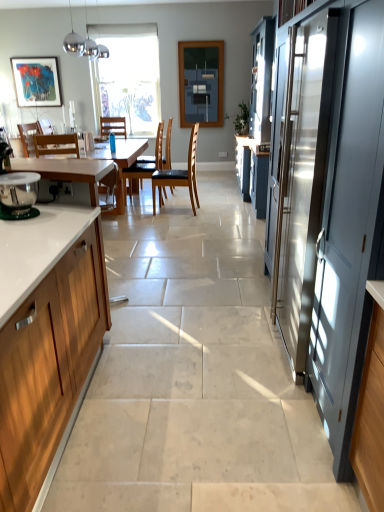
What do you see at coordinates (349, 227) in the screenshot? I see `matte gray screen door at right` at bounding box center [349, 227].

I want to click on matte gray screen door at right, so click(349, 227).

Identify the location of transparent glass window at center. (127, 76).

What do you see at coordinates (127, 76) in the screenshot? I see `transparent glass window at center` at bounding box center [127, 76].

Describe the element at coordinates (144, 165) in the screenshot. I see `wooden chair at center, the 3th chair when ordered from left to right` at that location.

Find the location of `matte glass window screen at center`. matte glass window screen at center is located at coordinates (201, 83).

You are a GUI agent. You are given a task and a screenshot of the screen. Output one action in this format:
    pyautogui.click(x=<x>, y=<y>)
    Task: Click on the black leather chair at center, placed as the first chair when sorted from right to left
    
    Given the screenshot: What is the action you would take?
    pyautogui.click(x=179, y=175)

Consider the image. Which is more to the left, white wood cabinet at left or wooden chair at center, positioned as the 2th chair in left-to-right order?

Positioned to the left is wooden chair at center, positioned as the 2th chair in left-to-right order.

You are a GUI agent. You are given a task and a screenshot of the screen. Output one action in this format:
    pyautogui.click(x=<x>, y=<y>)
    Task: Click on the 3rd chair directly beneath the white wood cabinet at left (from a real-world perspective)
    The image size is (384, 512).
    Given the screenshot: What is the action you would take?
    pyautogui.click(x=56, y=145)

Considering their positions, is white wood cabinet at left located in front of or behind wooden chair at center, which is counted as the third chair, starting from the right?

white wood cabinet at left is in front of wooden chair at center, which is counted as the third chair, starting from the right.

Is the surface of white wood cabinet at left in direct contact with wooden chair at center, positioned as the 2th chair in left-to-right order?

No, white wood cabinet at left is not beside wooden chair at center, positioned as the 2th chair in left-to-right order.

Is matte glass window screen at center at the back of wooden chair at center, the 3th chair when ordered from left to right?

No, wooden chair at center, the 3th chair when ordered from left to right,'s orientation is not away from matte glass window screen at center.

Is wooden chair at center, the 3th chair when ordered from left to right, not near matte glass window screen at center?

wooden chair at center, the 3th chair when ordered from left to right, is positioned a significant distance from matte glass window screen at center.

Is wooden chair at center, the 3th chair when ordered from left to right, bigger or smaller than matte glass window screen at center?

In the image, wooden chair at center, the 3th chair when ordered from left to right, appears to be larger than matte glass window screen at center.

Considering the relative sizes of wooden chair at center, marked as the 2th chair in a right-to-left arrangement, and matte glass window screen at center in the image provided, is wooden chair at center, marked as the 2th chair in a right-to-left arrangement, wider than matte glass window screen at center?

Yes.

Is matte gray screen door at right in front of matte black picture frame at upper left?

Yes, matte gray screen door at right is in front of matte black picture frame at upper left.

Does matte gray screen door at right have a greater height compared to matte black picture frame at upper left?

Yes, matte gray screen door at right is taller than matte black picture frame at upper left.

Is matte gray screen door at right surrounding matte black picture frame at upper left?

No, matte black picture frame at upper left is located outside of matte gray screen door at right.

Based on their positions, is matte gray screen door at right located to the left or right of matte black picture frame at upper left?

Clearly, matte gray screen door at right is on the right of matte black picture frame at upper left in the image.

Is matte black picture frame at upper left positioned behind matte gray screen door at right?

Yes, the depth of matte black picture frame at upper left is greater than that of matte gray screen door at right.

Locate an element on the screen. Image resolution: width=384 pixels, height=512 pixels. screen door below the matte black picture frame at upper left (from a real-world perspective) is located at coordinates (349, 227).

Is matte black picture frame at upper left positioned with its back to matte gray screen door at right?

No, matte black picture frame at upper left's orientation is not away from matte gray screen door at right.

Which object is closer to the camera taking this photo, wooden chair at center, positioned as the 2th chair in left-to-right order, or wooden chair at center, positioned as the first chair in left-to-right order?

wooden chair at center, positioned as the 2th chair in left-to-right order.

Is wooden chair at center, positioned as the 2th chair in left-to-right order, facing towards wooden chair at center, positioned as the first chair in left-to-right order?

No, wooden chair at center, positioned as the 2th chair in left-to-right order, is not oriented towards wooden chair at center, positioned as the first chair in left-to-right order.

From the picture: Considering the sizes of wooden chair at center, positioned as the 2th chair in left-to-right order, and wooden chair at center, which is counted as the fourth chair, starting from the right, in the image, is wooden chair at center, positioned as the 2th chair in left-to-right order, bigger or smaller than wooden chair at center, which is counted as the fourth chair, starting from the right,?

wooden chair at center, positioned as the 2th chair in left-to-right order, is bigger than wooden chair at center, which is counted as the fourth chair, starting from the right.

From a real-world perspective, which object stands above the other?

In real-world perspective, wooden chair at center, positioned as the first chair in left-to-right order, is above.

From the image's perspective, who appears lower, matte black picture frame at upper left or black leather chair at center, placed as the first chair when sorted from right to left?

black leather chair at center, placed as the first chair when sorted from right to left, from the image's perspective.

From a real-world perspective, is matte black picture frame at upper left above or below black leather chair at center, placed as the first chair when sorted from right to left?

In terms of real-world spatial position, matte black picture frame at upper left is above black leather chair at center, placed as the first chair when sorted from right to left.

Is matte black picture frame at upper left in contact with black leather chair at center, placed as the first chair when sorted from right to left?

matte black picture frame at upper left is not next to black leather chair at center, placed as the first chair when sorted from right to left, and they're not touching.

Is matte black picture frame at upper left situated inside white wood cabinet at left or outside?

matte black picture frame at upper left is outside white wood cabinet at left.

Is matte black picture frame at upper left not close to white wood cabinet at left?

Yes, matte black picture frame at upper left and white wood cabinet at left are quite far apart.

Is matte black picture frame at upper left aimed at white wood cabinet at left?

Yes, matte black picture frame at upper left is facing white wood cabinet at left.

Is matte black picture frame at upper left in front of or behind white wood cabinet at left in the image?

matte black picture frame at upper left is positioned farther from the viewer than white wood cabinet at left.

The width and height of the screenshot is (384, 512). What are the coordinates of `cabinetry on the right side of wooden chair at center, which is counted as the third chair, starting from the right` in the screenshot? It's located at (49, 362).

Find the location of a particular element. The image size is (384, 512). the 2nd chair counting from the left of the matte glass window screen at center is located at coordinates (144, 165).

When comparing their distances from matte gray screen door at right, does matte glass window screen at center or wooden chair at center, marked as the 2th chair in a right-to-left arrangement, seem closer?

The object closer to matte gray screen door at right is wooden chair at center, marked as the 2th chair in a right-to-left arrangement.

Based on their spatial positions, is wooden chair at center, the 3th chair when ordered from left to right, or wooden chair at center, which is counted as the fourth chair, starting from the right, further from wooden chair at center, positioned as the 2th chair in left-to-right order?

The object further to wooden chair at center, positioned as the 2th chair in left-to-right order, is wooden chair at center, which is counted as the fourth chair, starting from the right.

When comparing their distances from matte gray screen door at right, does transparent glass window at center or wooden chair at center, which is counted as the fourth chair, starting from the right, seem closer?

Based on the image, wooden chair at center, which is counted as the fourth chair, starting from the right, appears to be nearer to matte gray screen door at right.

Based on their spatial positions, is transparent glass window at center or matte black picture frame at upper left closer to black leather chair at center, placed as the first chair when sorted from right to left?

transparent glass window at center is positioned closer to the anchor black leather chair at center, placed as the first chair when sorted from right to left.

Which object lies nearer to the anchor point matte black picture frame at upper left, matte glass window screen at center or white wood cabinet at left?

matte glass window screen at center lies closer to matte black picture frame at upper left than the other object.

Based on their spatial positions, is matte gray screen door at right or wooden chair at center, positioned as the 2th chair in left-to-right order, further from transparent glass window at center?

matte gray screen door at right is positioned further to the anchor transparent glass window at center.

Which object lies nearer to the anchor point matte gray screen door at right, matte glass window screen at center or wooden chair at center, which is counted as the fourth chair, starting from the right?

The object closer to matte gray screen door at right is wooden chair at center, which is counted as the fourth chair, starting from the right.

Based on their spatial positions, is wooden chair at center, the 3th chair when ordered from left to right, or white wood cabinet at left closer to wooden chair at center, which is counted as the fourth chair, starting from the right?

Based on the image, wooden chair at center, the 3th chair when ordered from left to right, appears to be nearer to wooden chair at center, which is counted as the fourth chair, starting from the right.

Where is `window screen positioned between matte gray screen door at right and matte black picture frame at upper left from near to far`? The height and width of the screenshot is (512, 384). window screen positioned between matte gray screen door at right and matte black picture frame at upper left from near to far is located at coordinates (201, 83).

Locate an element on the screen. Image resolution: width=384 pixels, height=512 pixels. window between wooden chair at center, which is counted as the fourth chair, starting from the right, and matte glass window screen at center, in the horizontal direction is located at coordinates (127, 76).

Identify the location of chair located between wooden chair at center, which is counted as the third chair, starting from the right, and black leather chair at center, the fourth chair viewed from the left, in the left-right direction. This screenshot has width=384, height=512. (144, 165).

You are a GUI agent. You are given a task and a screenshot of the screen. Output one action in this format:
    pyautogui.click(x=<x>, y=<y>)
    Task: Click on the picture frame positioned between black leather chair at center, the fourth chair viewed from the left, and transparent glass window at center from near to far
    The height and width of the screenshot is (512, 384).
    Given the screenshot: What is the action you would take?
    pyautogui.click(x=36, y=81)